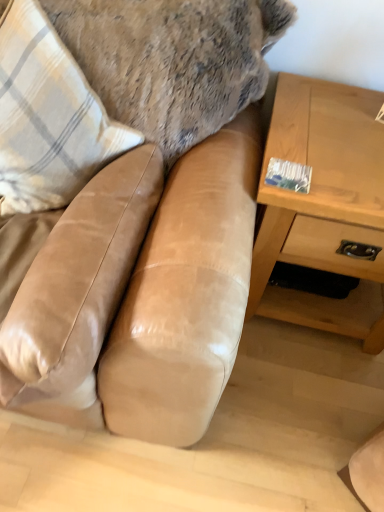
Identify the location of suede tan swivel chair at center. This screenshot has width=384, height=512. (78, 280).

Considering the sizes of objects tan leather couch at center and light brown wood table at right in the image provided, who is thinner, tan leather couch at center or light brown wood table at right?

light brown wood table at right is thinner.

How different are the orientations of tan leather couch at center and light brown wood table at right in degrees?

tan leather couch at center and light brown wood table at right are facing 0.0471 degrees away from each other.

Is tan leather couch at center far from light brown wood table at right?

No.

Measure the distance from tan leather couch at center to light brown wood table at right.

32.52 centimeters.

Considering the positions of objects suede tan swivel chair at center and tan leather couch at center in the image provided, who is in front, suede tan swivel chair at center or tan leather couch at center?

tan leather couch at center is more forward.

Is suede tan swivel chair at center next to tan leather couch at center?

Yes, suede tan swivel chair at center and tan leather couch at center clearly make contact.

Is suede tan swivel chair at center at the right side of tan leather couch at center?

Yes, suede tan swivel chair at center is to the right of tan leather couch at center.

Which object is wider, suede tan swivel chair at center or tan leather couch at center?

Wider between the two is tan leather couch at center.

Which is behind, plaid fabric pillow at left or suede tan swivel chair at center?

plaid fabric pillow at left is more distant.

Could you tell me if plaid fabric pillow at left is turned towards suede tan swivel chair at center?

Yes.

Can you confirm if plaid fabric pillow at left is shorter than suede tan swivel chair at center?

No.

Are plaid fabric pillow at left and suede tan swivel chair at center beside each other?

No, plaid fabric pillow at left is not making contact with suede tan swivel chair at center.

Would you say light brown wood table at right is a long distance from suede tan swivel chair at center?

That's not correct — light brown wood table at right is a little close to suede tan swivel chair at center.

From the picture: From a real-world perspective, relative to suede tan swivel chair at center, is light brown wood table at right vertically above or below?

light brown wood table at right is below suede tan swivel chair at center.

Is light brown wood table at right oriented away from suede tan swivel chair at center?

No.

What's the angular difference between light brown wood table at right and suede tan swivel chair at center's facing directions?

The angular difference between light brown wood table at right and suede tan swivel chair at center is 90 degrees.

Is plaid fabric pillow at left to the right of tan leather couch at center from the viewer's perspective?

No.

Is plaid fabric pillow at left inside or outside of tan leather couch at center?

plaid fabric pillow at left is contained in tan leather couch at center.

Considering the relative sizes of plaid fabric pillow at left and tan leather couch at center in the image provided, is plaid fabric pillow at left shorter than tan leather couch at center?

Yes, plaid fabric pillow at left is shorter than tan leather couch at center.

Between point (17, 27) and point (181, 380), which one is positioned in front?

The point (181, 380) is closer to the camera.

Which is behind, tan leather couch at center or plaid fabric pillow at left?

plaid fabric pillow at left.

I want to click on throw pillow that is above the tan leather couch at center (from the image's perspective), so click(48, 117).

Between tan leather couch at center and plaid fabric pillow at left, which one has larger width?

tan leather couch at center is wider.

Considering the sizes of tan leather couch at center and plaid fabric pillow at left in the image, is tan leather couch at center bigger or smaller than plaid fabric pillow at left?

Clearly, tan leather couch at center is larger in size than plaid fabric pillow at left.

Is point (290, 81) closer or farther from the camera than point (109, 186)?

Point (290, 81).

Is light brown wood table at right at the left side of tan leather couch at center?

No.

Considering the relative sizes of light brown wood table at right and tan leather couch at center in the image provided, is light brown wood table at right bigger than tan leather couch at center?

No, light brown wood table at right is not bigger than tan leather couch at center.

The width and height of the screenshot is (384, 512). Identify the location of table lying on the right of tan leather couch at center. (324, 206).

Where is `swivel chair behind the tan leather couch at center`? swivel chair behind the tan leather couch at center is located at coordinates (78, 280).

Based on their spatial positions, is plaid fabric pillow at left or suede tan swivel chair at center further from tan leather couch at center?

Based on the image, plaid fabric pillow at left appears to be further to tan leather couch at center.

Which object lies nearer to the anchor point tan leather couch at center, light brown wood table at right or plaid fabric pillow at left?

plaid fabric pillow at left.

Which object lies further to the anchor point plaid fabric pillow at left, light brown wood table at right or tan leather couch at center?

light brown wood table at right is positioned further to the anchor plaid fabric pillow at left.

Considering their positions, is tan leather couch at center positioned closer to light brown wood table at right than suede tan swivel chair at center?

tan leather couch at center is positioned closer to the anchor light brown wood table at right.

When comparing their distances from plaid fabric pillow at left, does suede tan swivel chair at center or light brown wood table at right seem closer?

The object closer to plaid fabric pillow at left is suede tan swivel chair at center.

Based on their spatial positions, is plaid fabric pillow at left or suede tan swivel chair at center closer to light brown wood table at right?

suede tan swivel chair at center lies closer to light brown wood table at right than the other object.

From the image, which object appears to be nearer to suede tan swivel chair at center, light brown wood table at right or plaid fabric pillow at left?

plaid fabric pillow at left is closer to suede tan swivel chair at center.

From the picture: Looking at the image, which one is located further to tan leather couch at center, suede tan swivel chair at center or light brown wood table at right?

The object further to tan leather couch at center is light brown wood table at right.

Identify the location of swivel chair between plaid fabric pillow at left and light brown wood table at right in the horizontal direction. This screenshot has height=512, width=384. (78, 280).

Where is `swivel chair between tan leather couch at center and light brown wood table at right`? This screenshot has width=384, height=512. swivel chair between tan leather couch at center and light brown wood table at right is located at coordinates (78, 280).

What are the coordinates of `studio couch between plaid fabric pillow at left and light brown wood table at right` in the screenshot? It's located at (186, 295).

I want to click on swivel chair between tan leather couch at center and plaid fabric pillow at left from front to back, so click(x=78, y=280).